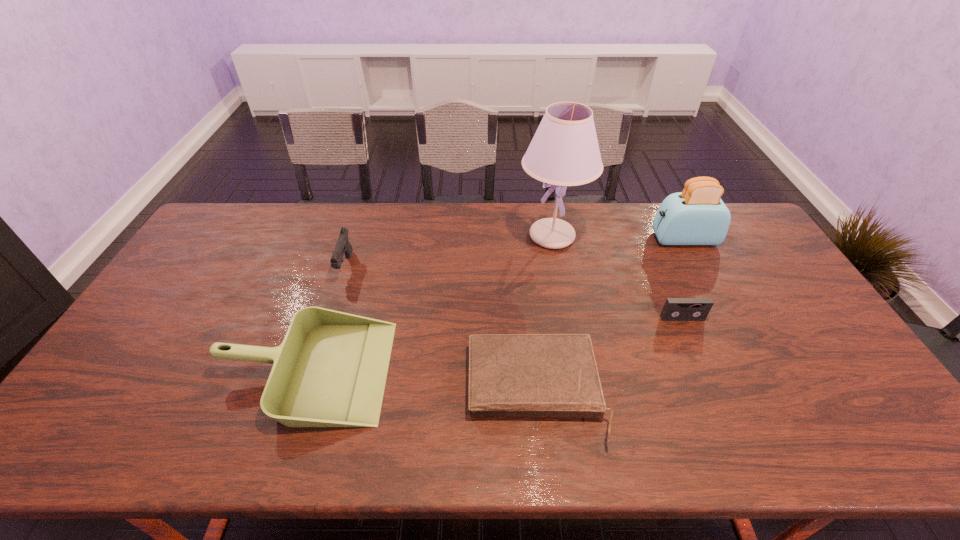
I want to click on free space between the second tallest object and the tallest object, so click(617, 238).

Point out which object is positioned as the second nearest to the videotape. Please provide its 2D coordinates. Your answer should be formatted as a tuple, i.e. [(x, y)], where the tuple contains the x and y coordinates of a point satisfying the conditions above.

[(564, 151)]

Where is `object that is the fourth closest to the second tallest object`? Image resolution: width=960 pixels, height=540 pixels. object that is the fourth closest to the second tallest object is located at coordinates (330, 371).

At what (x,y) coordinates should I click in order to perform the action: click on free spot that satisfies the following two spatial constraints: 1. on the side of the fifth shortest object with the lever; 2. on the spine side of the paperback book. Please return your answer as a coordinate pair (x, y). The width and height of the screenshot is (960, 540). Looking at the image, I should click on (763, 392).

Locate an element on the screen. The width and height of the screenshot is (960, 540). blank space that satisfies the following two spatial constraints: 1. on the side of the fifth shortest object with the lever; 2. at the barrel of the pistol is located at coordinates (698, 267).

The width and height of the screenshot is (960, 540). Find the location of `free space that satisfies the following two spatial constraints: 1. at the barrel of the pistol; 2. on the scoop of the dustpan`. free space that satisfies the following two spatial constraints: 1. at the barrel of the pistol; 2. on the scoop of the dustpan is located at coordinates (312, 370).

You are a GUI agent. You are given a task and a screenshot of the screen. Output one action in this format:
    pyautogui.click(x=<x>, y=<y>)
    Task: Click on the free space that satisfies the following two spatial constraints: 1. at the barrel of the pistol; 2. on the scoop of the dustpan
    This screenshot has width=960, height=540.
    Given the screenshot: What is the action you would take?
    pyautogui.click(x=312, y=370)

Where is `vacant space that satisfies the following two spatial constraints: 1. at the barrel of the pistol; 2. on the scoop of the dustpan`? Image resolution: width=960 pixels, height=540 pixels. vacant space that satisfies the following two spatial constraints: 1. at the barrel of the pistol; 2. on the scoop of the dustpan is located at coordinates (312, 370).